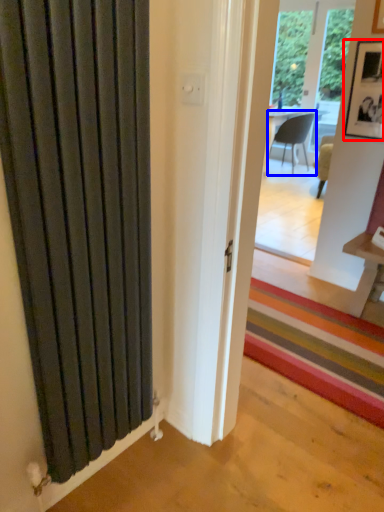
Question: Among these objects, which one is nearest to the camera, picture frame (highlighted by a red box) or chair (highlighted by a blue box)?

Choices:
 (A) picture frame
 (B) chair

Answer: (A)